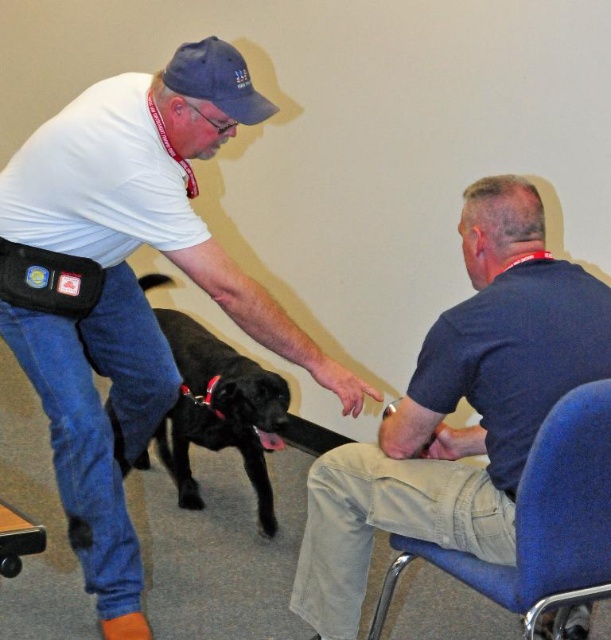
Based on the scene description, can you determine if the dark blue shirt at right is worn by the seated individual on the blue fabric chair at lower right?

Yes, the dark blue shirt at right is positioned over the blue fabric chair at lower right, indicating that the seated individual is wearing it.

You are standing at the point labeled as point (x=332, y=500) and want to walk to the point labeled as point (x=557, y=605). Is there a clear path between these two points without needing to go around any obstacles?

Yes, there is a clear path between point (x=332, y=500) and point (x=557, y=605) because the first point is behind the second point, so you can walk straight towards it without obstacles.